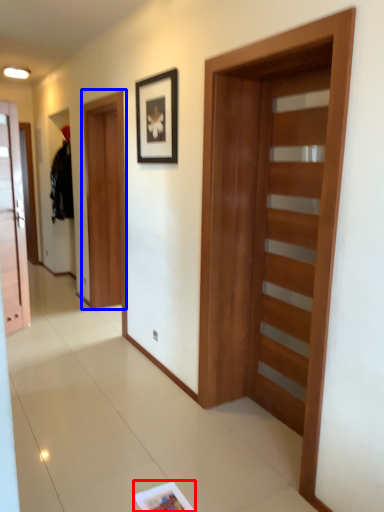
Question: Which point is closer to the camera, magazine (highlighted by a red box) or barn door (highlighted by a blue box)?

Choices:
 (A) magazine
 (B) barn door

Answer: (A)